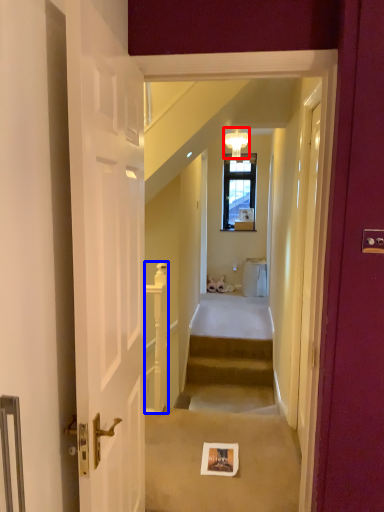
Question: Which object is closer to the camera taking this photo, light fixture (highlighted by a red box) or balustrade (highlighted by a blue box)?

Choices:
 (A) light fixture
 (B) balustrade

Answer: (B)